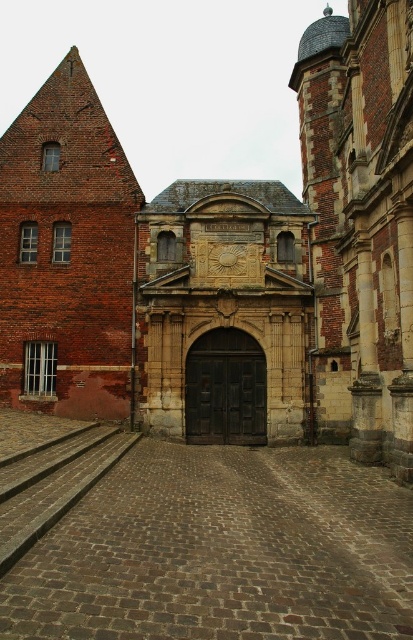
The width and height of the screenshot is (413, 640). What are the coordinates of `brick wall at left` in the screenshot? It's located at (66, 253).

Does point (109, 253) come behind point (87, 438)?

Yes, it is.

Locate an element on the screen. The image size is (413, 640). brick wall at left is located at coordinates (66, 253).

Consider the image. Is stone carved gate at center to the right of gray concrete steps at lower left from the viewer's perspective?

Yes, stone carved gate at center is to the right of gray concrete steps at lower left.

Is stone carved gate at center thinner than gray concrete steps at lower left?

No, stone carved gate at center is not thinner than gray concrete steps at lower left.

Does point (256, 305) lie in front of point (90, 444)?

No.

Where is `stone carved gate at center`? Image resolution: width=413 pixels, height=640 pixels. stone carved gate at center is located at coordinates (223, 310).

Measure the distance between brown cobblestone train track at center and gray concrete steps at lower left.

brown cobblestone train track at center and gray concrete steps at lower left are 6.05 meters apart.

Who is shorter, brown cobblestone train track at center or gray concrete steps at lower left?

With less height is gray concrete steps at lower left.

Is point (71, 586) more distant than point (12, 516)?

No.

I want to click on brown cobblestone train track at center, so click(x=199, y=541).